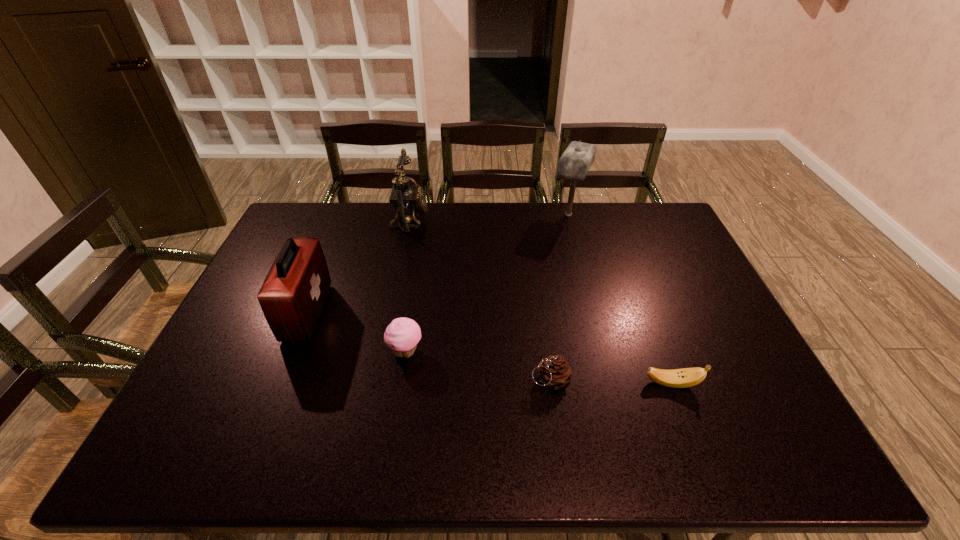
The image size is (960, 540). Identify the location of vacant space at the near edge. (698, 449).

The image size is (960, 540). In order to click on free space at the left edge of the desktop in this screenshot , I will do `click(177, 416)`.

Image resolution: width=960 pixels, height=540 pixels. In the image, there is a desktop. In order to click on vacant area at the right edge in this screenshot , I will do `click(669, 262)`.

In order to click on free space at the far left corner of the desktop in this screenshot , I will do `click(286, 227)`.

Find the location of a particular element. vacant position at the far right corner of the desktop is located at coordinates pyautogui.click(x=673, y=226).

I want to click on vacant area that lies between the first aid kit and the cupcake, so click(356, 332).

Locate an element on the screen. This screenshot has width=960, height=540. vacant area between the fourth object from left to right and the mallet is located at coordinates (560, 297).

Identify the location of empty space between the leftmost object and the cupcake. The width and height of the screenshot is (960, 540). (356, 332).

Locate an element on the screen. The width and height of the screenshot is (960, 540). free space between the cupcake and the pinecone is located at coordinates (478, 366).

Find the location of `empty space that is in between the third object from right to left and the first aid kit`. empty space that is in between the third object from right to left and the first aid kit is located at coordinates (428, 346).